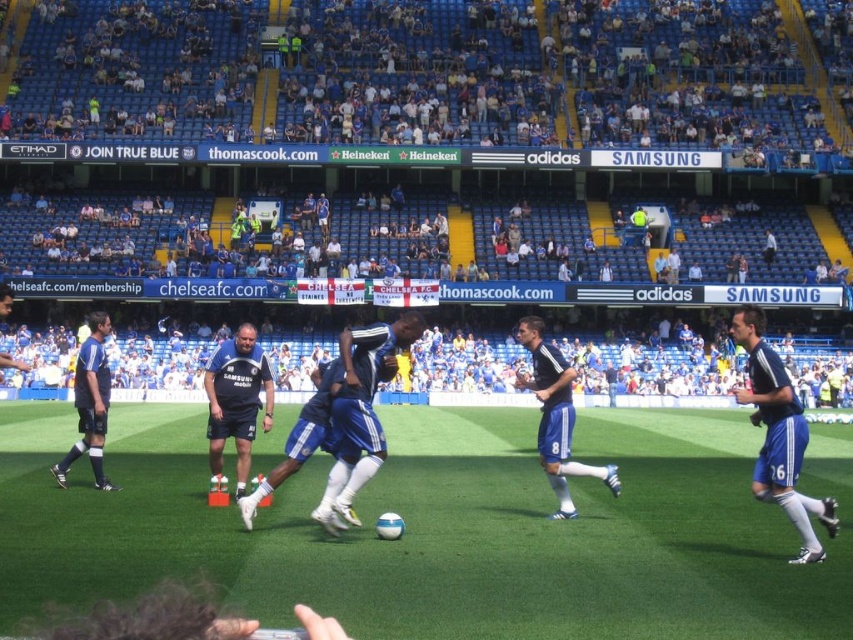
You are a drone operator trying to capture the soccer match. The ball is currently near the center of the field. To ensure the ball is visible in your shot, where should you position the drone relative to the green artificial turf at center?

The green artificial turf at center is located at point (445, 529), so you should position the drone near that coordinate to ensure the ball is visible.

Looking at this image, you are a drone operator trying to capture aerial footage of the soccer match. The camera is currently positioned at the stadium roof. To ensure the green artificial turf at center is in the center of the footage, where should you move the camera? Specify the coordinates as a point in the form of x,y between 0 and 1.

The green artificial turf at center is located at point (445, 529), so you should move the camera to that coordinate to center it in the footage.